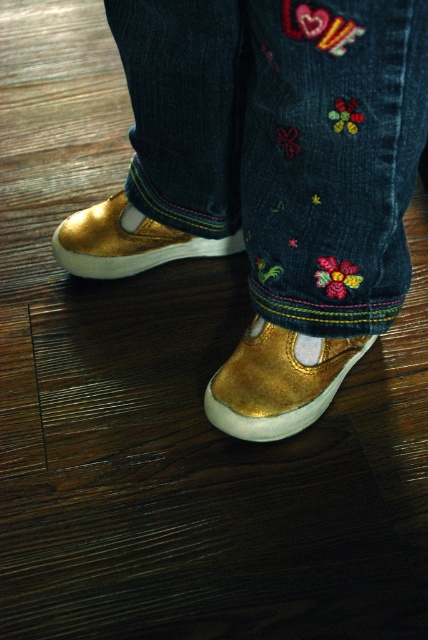
Which is more to the left, denim jeans with embroidered patches at center or gold suede shoe at lower center?

Positioned to the left is denim jeans with embroidered patches at center.

Does denim jeans with embroidered patches at center have a lesser width compared to gold suede shoe at lower center?

In fact, denim jeans with embroidered patches at center might be wider than gold suede shoe at lower center.

Find the location of a particular element. Image resolution: width=428 pixels, height=640 pixels. denim jeans with embroidered patches at center is located at coordinates (284, 141).

This screenshot has height=640, width=428. Find the location of `denim jeans with embroidered patches at center`. denim jeans with embroidered patches at center is located at coordinates (284, 141).

Is gold suede shoe at lower center taller than gold metallic shoe at left?

Correct, gold suede shoe at lower center is much taller as gold metallic shoe at left.

Is gold suede shoe at lower center above gold metallic shoe at left?

Incorrect, gold suede shoe at lower center is not positioned above gold metallic shoe at left.

Which is in front, point (261, 346) or point (118, 228)?

Point (261, 346) is in front.

You are a GUI agent. You are given a task and a screenshot of the screen. Output one action in this format:
    pyautogui.click(x=<x>, y=<y>)
    Task: Click on the gold suede shoe at lower center
    Image resolution: width=428 pixels, height=640 pixels.
    Given the screenshot: What is the action you would take?
    pyautogui.click(x=279, y=381)

Can you confirm if denim jeans with embroidered patches at center is shorter than gold metallic shoe at left?

Incorrect, denim jeans with embroidered patches at center's height does not fall short of gold metallic shoe at left's.

Who is more forward, (228, 202) or (91, 208)?

Point (228, 202) is more forward.

Between point (380, 42) and point (73, 221), which one is positioned in front?

Positioned in front is point (380, 42).

This screenshot has width=428, height=640. What are the coordinates of `denim jeans with embroidered patches at center` in the screenshot? It's located at (284, 141).